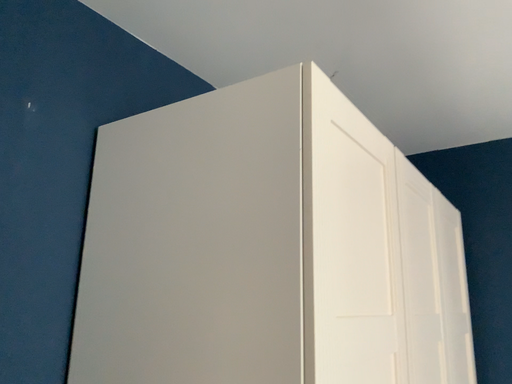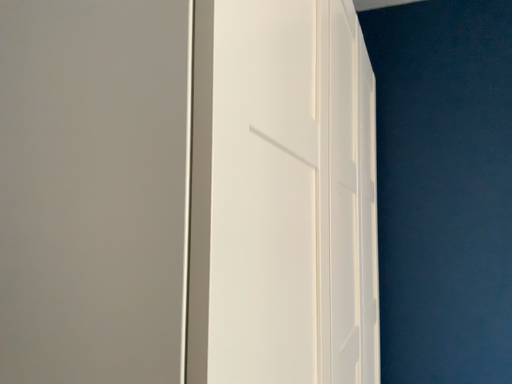
Question: How did the camera likely rotate when shooting the video?

Choices:
 (A) rotated right
 (B) rotated left

Answer: (A)